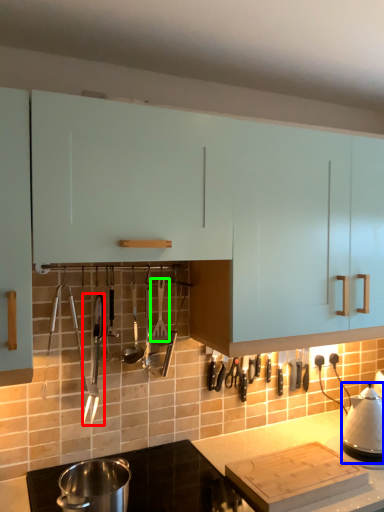
Question: Estimate the real-world distances between objects in this image. Which object is farther from silverware (highlighted by a red box), kitchen appliance (highlighted by a blue box) or silverware (highlighted by a green box)?

Choices:
 (A) kitchen appliance
 (B) silverware

Answer: (A)